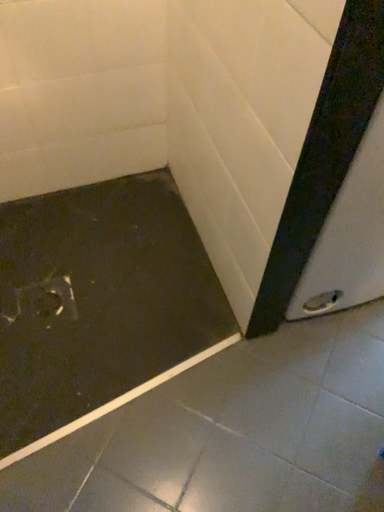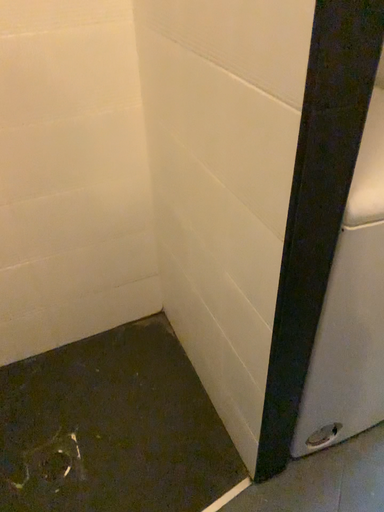
Question: How did the camera likely rotate when shooting the video?

Choices:
 (A) rotated upward
 (B) rotated downward

Answer: (A)